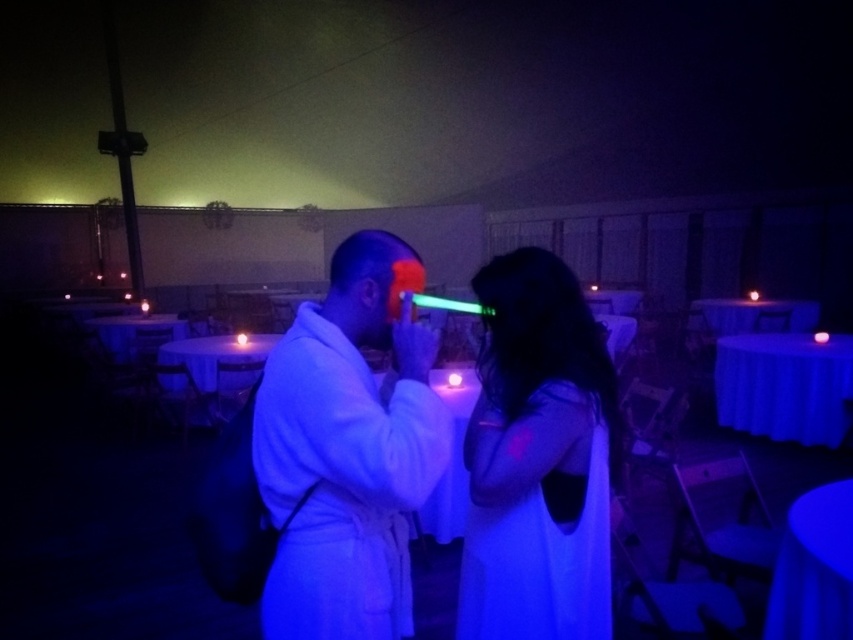
Question: Which point is farther to the camera?

Choices:
 (A) matte black dress at center
 (B) white matte bathrobe at center

Answer: (A)

Question: Which of the following is the closest to the observer?

Choices:
 (A) (537, 355)
 (B) (387, 515)

Answer: (B)

Question: Is white matte bathrobe at center above matte black dress at center?

Choices:
 (A) yes
 (B) no

Answer: (A)

Question: Among these points, which one is farthest from the camera?

Choices:
 (A) (347, 595)
 (B) (584, 337)

Answer: (B)

Question: Can you confirm if white matte bathrobe at center is bigger than matte black dress at center?

Choices:
 (A) yes
 (B) no

Answer: (A)

Question: Can you confirm if white matte bathrobe at center is positioned to the right of matte black dress at center?

Choices:
 (A) yes
 (B) no

Answer: (B)